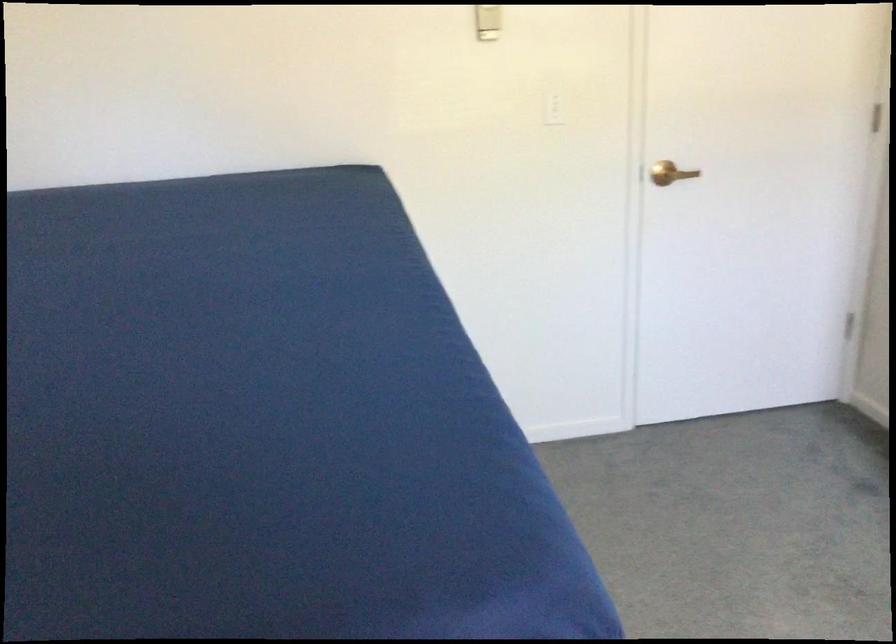
Where is `light switch`? The height and width of the screenshot is (644, 896). light switch is located at coordinates (554, 108).